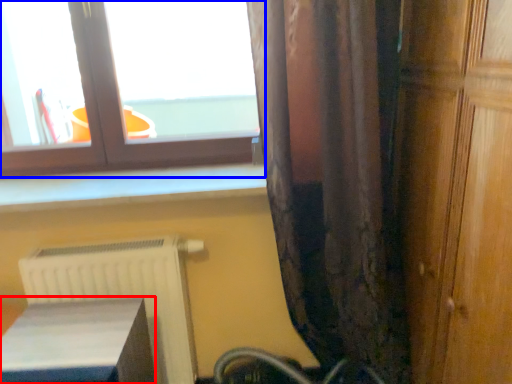
Question: Which object is further to the camera taking this photo, furniture (highlighted by a red box) or window (highlighted by a blue box)?

Choices:
 (A) furniture
 (B) window

Answer: (B)